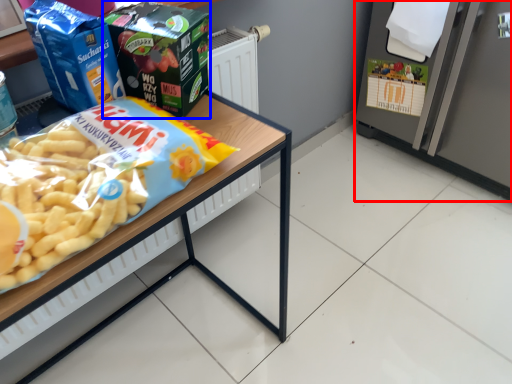
Question: Among these objects, which one is farthest to the camera, appliance (highlighted by a red box) or product (highlighted by a blue box)?

Choices:
 (A) appliance
 (B) product

Answer: (A)